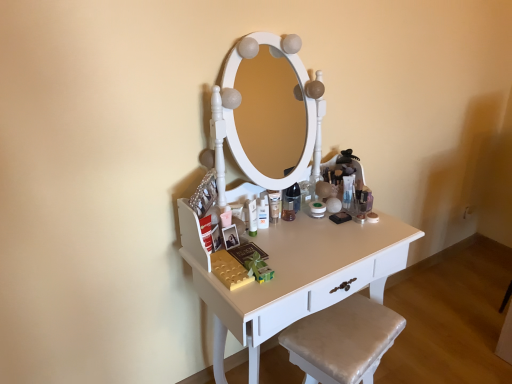
Question: Can we say translucent plastic tube at center, the first toiletry positioned from the back, lies outside matte white lotion at center, which is the first toiletry from left to right?

Choices:
 (A) no
 (B) yes

Answer: (B)

Question: Considering the relative positions of translucent plastic tube at center, the first toiletry positioned from the back, and matte white lotion at center, the 1th toiletry from the front, in the image provided, is translucent plastic tube at center, the first toiletry positioned from the back, behind matte white lotion at center, the 1th toiletry from the front,?

Choices:
 (A) yes
 (B) no

Answer: (A)

Question: From the image's perspective, is translucent plastic tube at center, arranged as the second toiletry when viewed from the front, above matte white lotion at center, the 1th toiletry from the front?

Choices:
 (A) yes
 (B) no

Answer: (A)

Question: From the image's perspective, is translucent plastic tube at center, arranged as the second toiletry when viewed from the front, beneath matte white lotion at center, the second toiletry from the right?

Choices:
 (A) no
 (B) yes

Answer: (A)

Question: Is translucent plastic tube at center, the first toiletry positioned from the back, at the right side of matte white lotion at center, the second toiletry from the right?

Choices:
 (A) no
 (B) yes

Answer: (B)

Question: Is white glossy table at center wider or thinner than satin beige cushion at lower right?

Choices:
 (A) wide
 (B) thin

Answer: (A)

Question: Is white glossy table at center in front of or behind satin beige cushion at lower right in the image?

Choices:
 (A) behind
 (B) front

Answer: (B)

Question: Does point (290, 296) appear closer or farther from the camera than point (376, 327)?

Choices:
 (A) closer
 (B) farther

Answer: (A)

Question: Which is correct: white glossy table at center is inside satin beige cushion at lower right, or outside of it?

Choices:
 (A) inside
 (B) outside

Answer: (B)

Question: From the image's perspective, relative to white glossy table at center, is matte white lotion at center, the 1th toiletry from the front, above or below?

Choices:
 (A) above
 (B) below

Answer: (A)

Question: Is matte white lotion at center, the 1th toiletry from the front, taller or shorter than white glossy table at center?

Choices:
 (A) tall
 (B) short

Answer: (B)

Question: From a real-world perspective, is matte white lotion at center, the 1th toiletry from the front, above or below white glossy table at center?

Choices:
 (A) below
 (B) above

Answer: (B)

Question: Is matte white lotion at center, which is the second toiletry in back-to-front order, bigger or smaller than white glossy table at center?

Choices:
 (A) big
 (B) small

Answer: (B)

Question: Is white glossy table at center wider or thinner than translucent plastic tube at center, arranged as the 1th toiletry when viewed from the right?

Choices:
 (A) wide
 (B) thin

Answer: (A)

Question: From a real-world perspective, is white glossy table at center positioned above or below translucent plastic tube at center, arranged as the 1th toiletry when viewed from the right?

Choices:
 (A) above
 (B) below

Answer: (B)